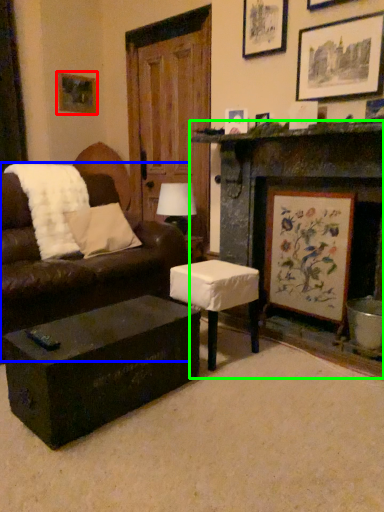
Question: Which object is positioned farthest from picture frame (highlighted by a red box)? Select from studio couch (highlighted by a blue box) and fireplace (highlighted by a green box).

Choices:
 (A) studio couch
 (B) fireplace

Answer: (B)